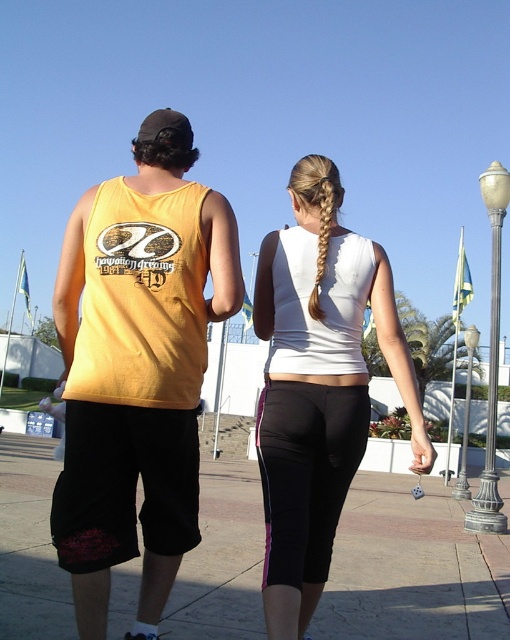
Who is positioned more to the right, yellow cotton tank top at left or golden blonde hair at upper center?

yellow cotton tank top at left

This screenshot has height=640, width=510. What do you see at coordinates (137, 364) in the screenshot? I see `yellow cotton tank top at left` at bounding box center [137, 364].

What do you see at coordinates (137, 364) in the screenshot? The height and width of the screenshot is (640, 510). I see `yellow cotton tank top at left` at bounding box center [137, 364].

You are a GUI agent. You are given a task and a screenshot of the screen. Output one action in this format:
    pyautogui.click(x=<x>, y=<y>)
    Task: Click on the yellow cotton tank top at left
    The height and width of the screenshot is (640, 510).
    Given the screenshot: What is the action you would take?
    pyautogui.click(x=137, y=364)

Who is more distant from viewer, (298, 196) or (323, 188)?

The point (298, 196) is behind.

Can you confirm if white matte tank top at center is bigger than golden blonde hair at upper center?

No, white matte tank top at center is not bigger than golden blonde hair at upper center.

Between point (268, 460) and point (312, 296), which one is positioned in front?

Point (268, 460) is more forward.

This screenshot has width=510, height=640. What are the coordinates of `white matte tank top at center` in the screenshot? It's located at (318, 397).

Does black rubber pavement at lower center come behind golden blonde hair at upper center?

Yes, black rubber pavement at lower center is behind golden blonde hair at upper center.

This screenshot has width=510, height=640. Identify the location of black rubber pavement at lower center. coord(408,570).

Based on the photo, who is more distant from viewer, (431, 520) or (325, 196)?

Positioned behind is point (431, 520).

The image size is (510, 640). Identify the location of black rubber pavement at lower center. (408, 570).